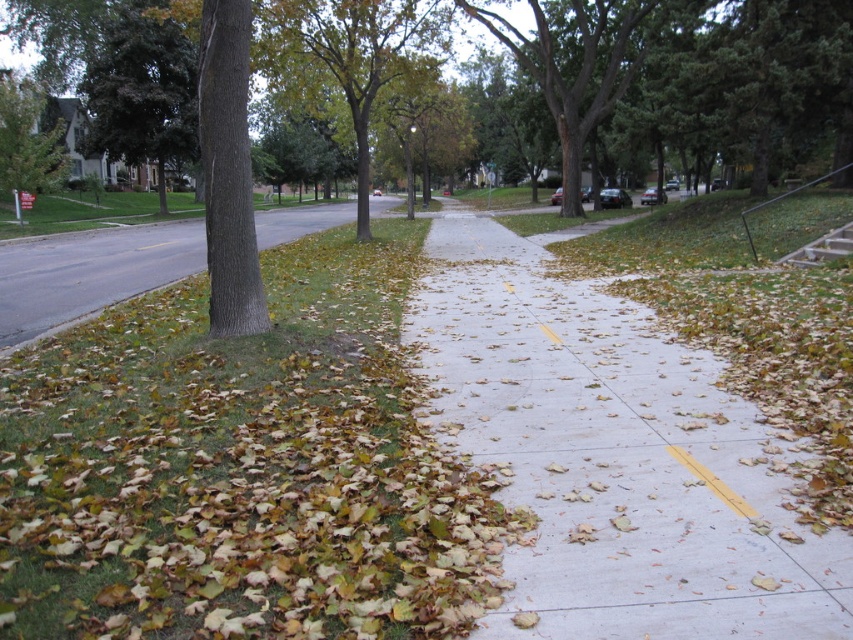
Question: Which point is farther to the camera?

Choices:
 (A) (137, 10)
 (B) (753, 461)
 (C) (38, 134)
 (D) (80, 289)

Answer: (A)

Question: Which point is farther to the camera?

Choices:
 (A) concrete sidewalk at center
 (B) green leafy tree at left
 (C) brown concrete sidewalk at left

Answer: (B)

Question: Which point is closer to the camera taking this photo?

Choices:
 (A) (287, 28)
 (B) (18, 246)
 (C) (532, 605)
 (D) (100, 72)

Answer: (C)

Question: Is brown concrete sidewalk at left to the right of green leafy tree at left from the viewer's perspective?

Choices:
 (A) yes
 (B) no

Answer: (A)

Question: Does brown concrete sidewalk at left appear under green leafy tree at left?

Choices:
 (A) no
 (B) yes

Answer: (B)

Question: Can you confirm if concrete sidewalk at center is bigger than brown concrete sidewalk at left?

Choices:
 (A) no
 (B) yes

Answer: (A)